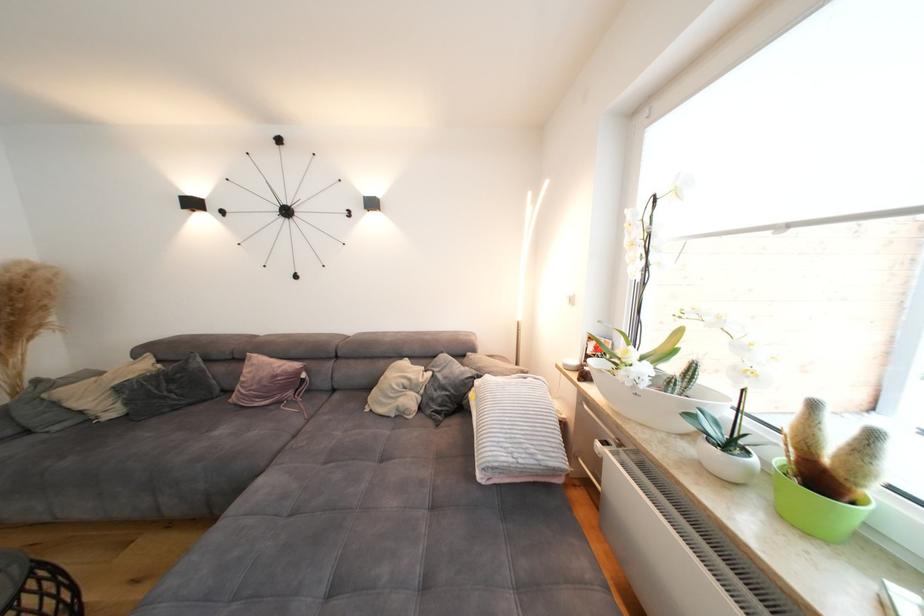
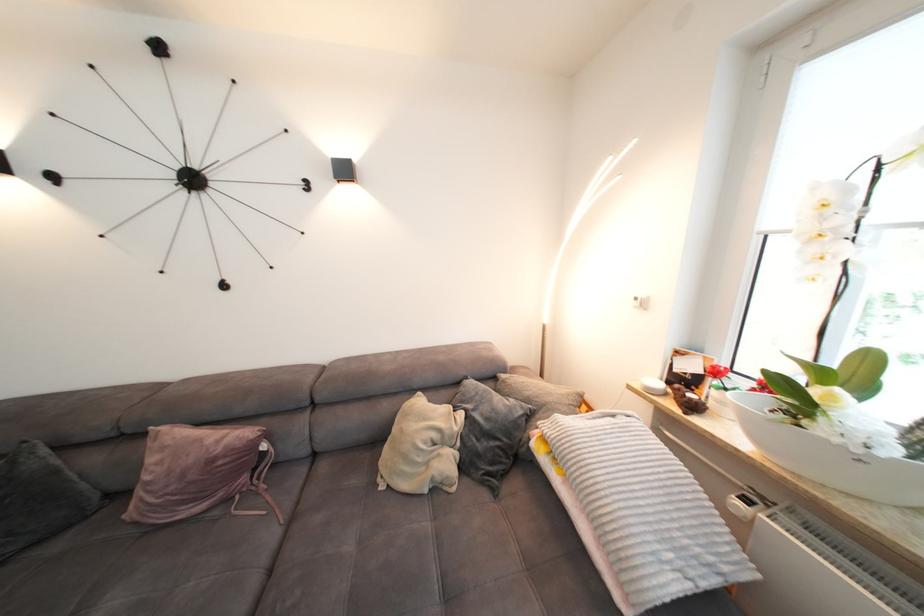
Find the pixel in the second image that matches point 225,391 in the first image.

(103, 498)